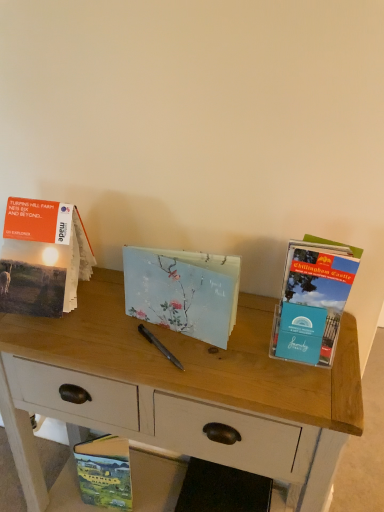
Question: From a real-world perspective, is hardcover book at lower left, which is counted as the first book, starting from the bottom, above or below wooden desk at center?

Choices:
 (A) below
 (B) above

Answer: (A)

Question: Does point (129, 460) appear closer or farther from the camera than point (311, 468)?

Choices:
 (A) closer
 (B) farther

Answer: (B)

Question: Based on their relative distances, which object is farther from the light blue textured notebook at center, the 2th book when ordered from right to left?

Choices:
 (A) hardcover book at lower left, which appears as the 2th book when viewed from the left
 (B) wooden desk at center
 (C) matte paper book at left, the first book in the left-to-right sequence
 (D) blue cardstock brochure at right, which appears as the third book when viewed from the top

Answer: (A)

Question: Which object is the closest to the matte paper book at left, acting as the 4th book starting from the right?

Choices:
 (A) blue cardstock brochure at right, which appears as the third book when viewed from the top
 (B) hardcover book at lower left, arranged as the 4th book when viewed from the top
 (C) light blue textured notebook at center, marked as the third book in a left-to-right arrangement
 (D) wooden desk at center

Answer: (C)